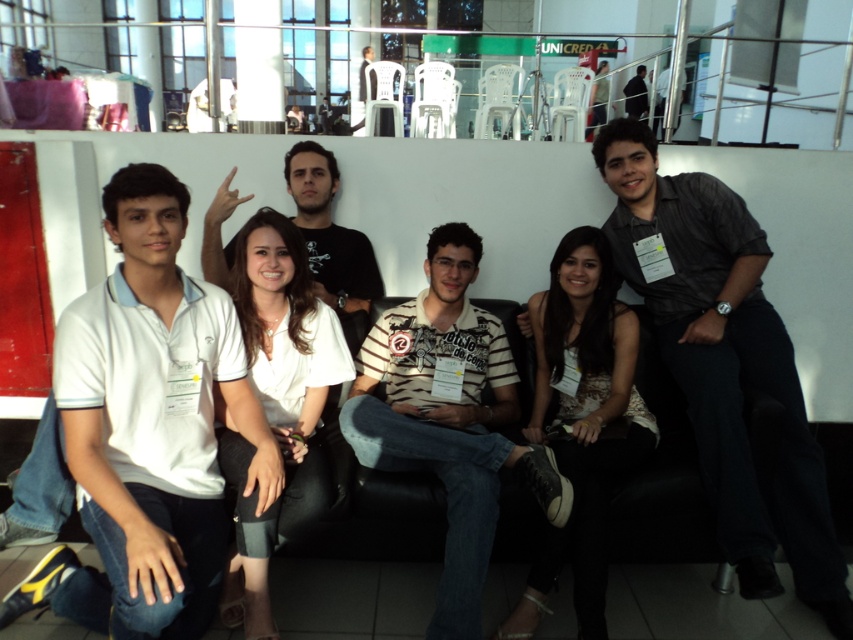
You are a photographer trying to adjust the lighting for the group photo. Since the white cotton polo shirt at left and the black shirt at upper center are both in the frame, which shirt requires more careful lighting adjustment due to its size?

The white cotton polo shirt at left requires more careful lighting adjustment because its width surpasses that of the black shirt at upper center.